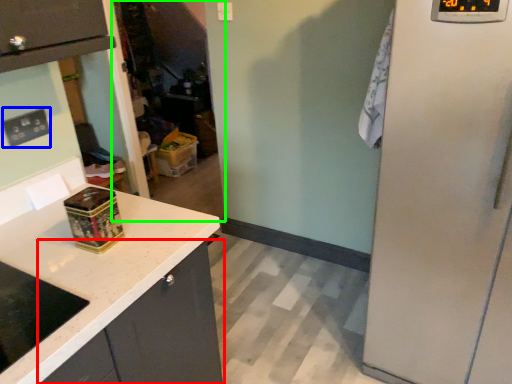
Question: Estimate the real-world distances between objects in this image. Which object is closer to cabinetry (highlighted by a red box), electric outlet (highlighted by a blue box) or glass door (highlighted by a green box)?

Choices:
 (A) electric outlet
 (B) glass door

Answer: (A)